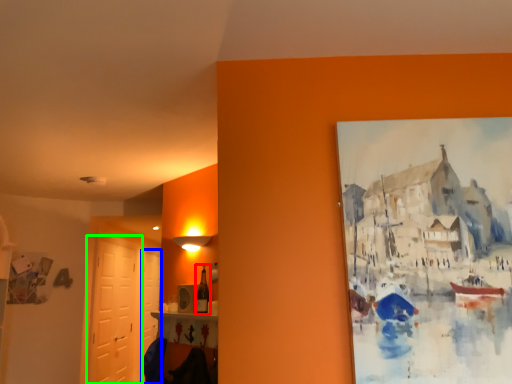
Question: Considering the real-world distances, which object is farthest from bottle (highlighted by a red box)? door (highlighted by a blue box) or door (highlighted by a green box)?

Choices:
 (A) door
 (B) door

Answer: (B)